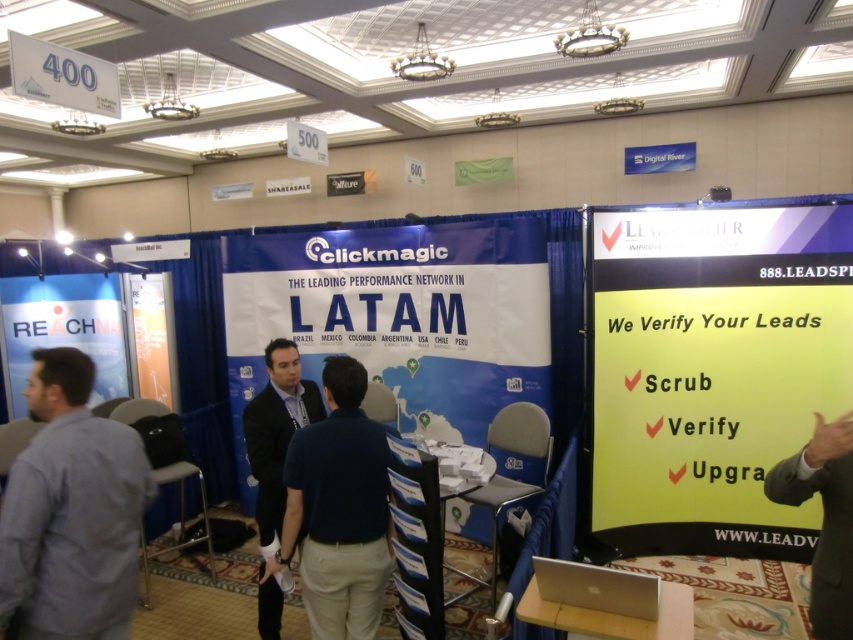
Can you confirm if gray shirt at left is smaller than dark blue suit at center?

Indeed, gray shirt at left has a smaller size compared to dark blue suit at center.

Is point (99, 596) positioned before point (259, 461)?

Yes, it is.

Which is behind, point (120, 468) or point (247, 440)?

The point (247, 440) is behind.

This screenshot has width=853, height=640. Find the location of `gray shirt at left`. gray shirt at left is located at coordinates (71, 512).

Does point (842, 544) come farther from viewer compared to point (277, 410)?

No, it is in front of (277, 410).

Measure the distance from slate gray suit at right to dark blue suit at center.

slate gray suit at right and dark blue suit at center are 6.38 feet apart from each other.

This screenshot has height=640, width=853. Identify the location of slate gray suit at right. click(x=824, y=518).

Is point (103, 420) closer to viewer compared to point (367, 445)?

Yes, point (103, 420) is in front of point (367, 445).

Between gray shirt at left and dark blue shirt at center, which one appears on the left side from the viewer's perspective?

gray shirt at left is more to the left.

Describe the element at coordinates (71, 512) in the screenshot. I see `gray shirt at left` at that location.

Find the location of `gray shirt at left`. gray shirt at left is located at coordinates (71, 512).